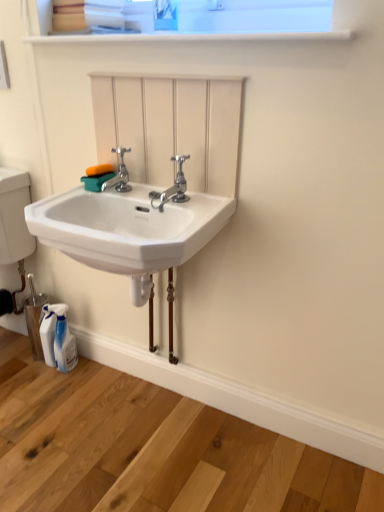
At what (x,y) coordinates should I click in order to perform the action: click on vacant space to the right of polished chrome faucet at center, the 2th tap from the left. Please return your answer as a coordinate pair (x, y). The image size is (384, 512). Looking at the image, I should click on (206, 203).